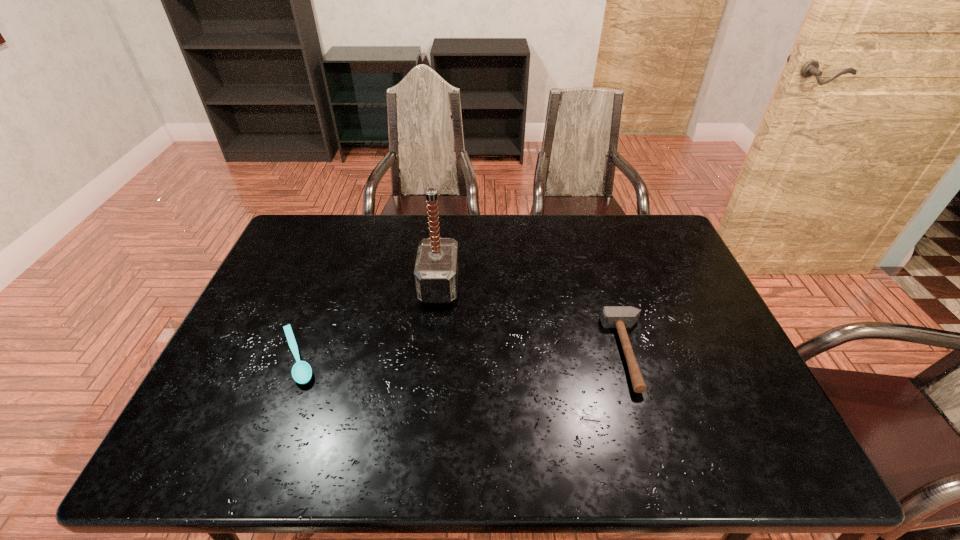
Where is `vacant space that satisfies the following two spatial constraints: 1. on the striking surface of the rightmost object; 2. on the front side of the shortest object`? vacant space that satisfies the following two spatial constraints: 1. on the striking surface of the rightmost object; 2. on the front side of the shortest object is located at coordinates (630, 356).